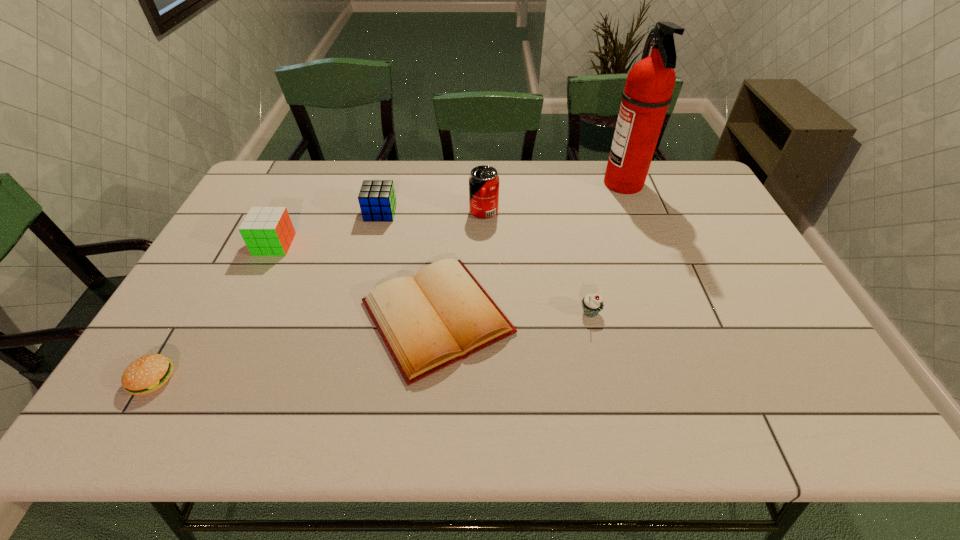
At what (x,y) coordinates should I click in order to perform the action: click on the rightmost object. Please return your answer as a coordinate pair (x, y). Image resolution: width=960 pixels, height=540 pixels. Looking at the image, I should click on (648, 91).

At what (x,y) coordinates should I click in order to perform the action: click on fire extinguisher. Please return your answer as a coordinate pair (x, y). The image size is (960, 540). Looking at the image, I should click on (648, 91).

Where is `the sixth shortest object`? This screenshot has height=540, width=960. the sixth shortest object is located at coordinates (484, 181).

Find the location of `the nearer cube`. the nearer cube is located at coordinates (267, 231).

Where is `the sixth object from right to left`? The height and width of the screenshot is (540, 960). the sixth object from right to left is located at coordinates (267, 231).

Locate an element on the screen. The image size is (960, 540). the farther cube is located at coordinates (377, 199).

At what (x,y) coordinates should I click in order to perform the action: click on cupcake. Please return your answer as a coordinate pair (x, y). The image size is (960, 540). Looking at the image, I should click on (592, 304).

At what (x,y) coordinates should I click in order to perform the action: click on the third shortest object. Please return your answer as a coordinate pair (x, y). This screenshot has height=540, width=960. Looking at the image, I should click on click(592, 304).

The height and width of the screenshot is (540, 960). In order to click on the leftmost object in this screenshot , I will do `click(148, 373)`.

This screenshot has height=540, width=960. Find the location of `Bible`. Bible is located at coordinates (443, 315).